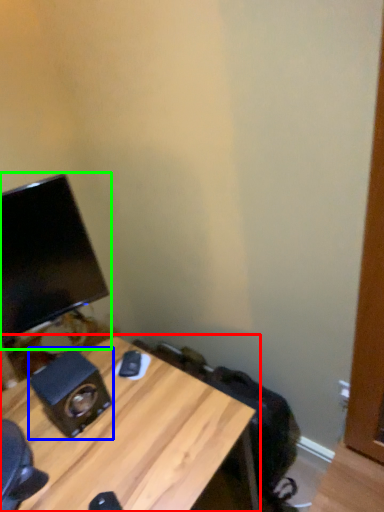
Question: Estimate the real-world distances between objects in this image. Which object is farther from desk (highlighted by a red box), speaker (highlighted by a blue box) or computer monitor (highlighted by a green box)?

Choices:
 (A) speaker
 (B) computer monitor

Answer: (B)